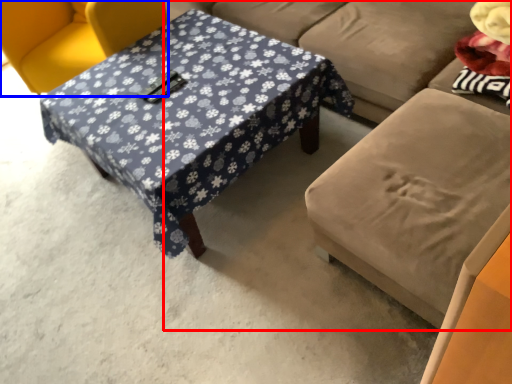
Question: Which object is closer to the camera taking this photo, studio couch (highlighted by a red box) or chair (highlighted by a blue box)?

Choices:
 (A) studio couch
 (B) chair

Answer: (A)